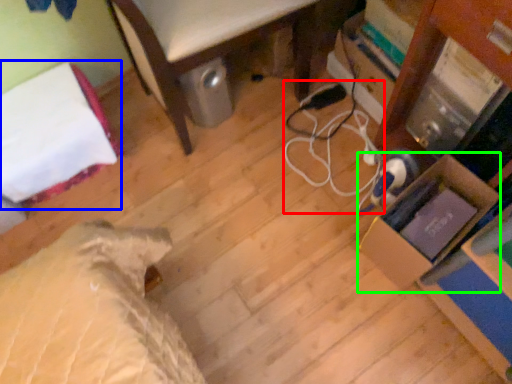
Question: Which object is positioned closest to cable (highlighted by a red box)? Select from bed (highlighted by a blue box) and cardboard box (highlighted by a green box).

Choices:
 (A) bed
 (B) cardboard box

Answer: (B)